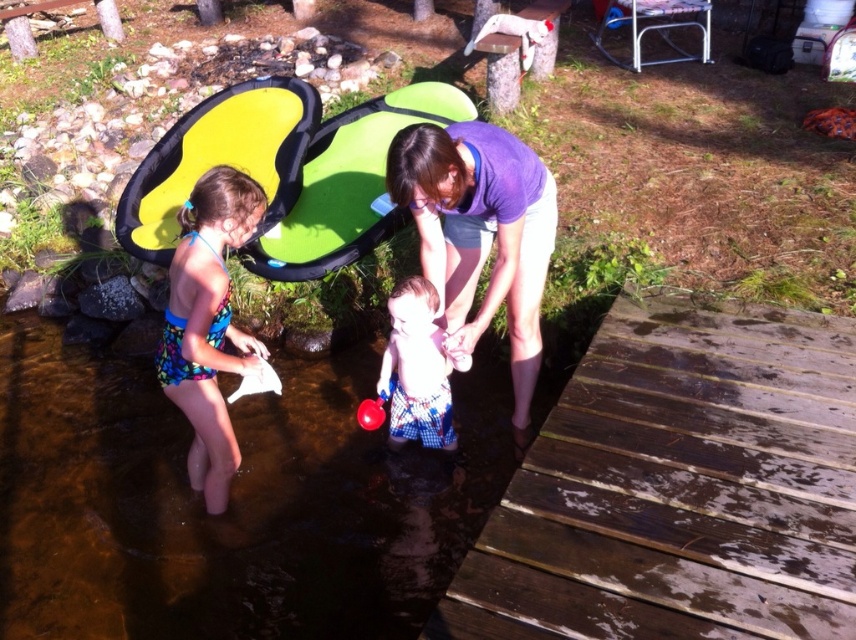
Question: Does brown wooden dock at lower right come in front of purple cotton shirt at center?

Choices:
 (A) no
 (B) yes

Answer: (B)

Question: Is clear water at center below plaid shorts at center?

Choices:
 (A) no
 (B) yes

Answer: (B)

Question: Estimate the real-world distances between objects in this image. Which object is closer to the purple cotton shirt at center?

Choices:
 (A) brown wooden dock at lower right
 (B) green inflatable at upper center

Answer: (A)

Question: Is purple cotton shirt at center above multicolored fabric swimsuit at lower left?

Choices:
 (A) no
 (B) yes

Answer: (B)

Question: Which point is closer to the camera taking this photo?

Choices:
 (A) (174, 266)
 (B) (476, 276)

Answer: (A)

Question: Which of the following is the closest to the observer?

Choices:
 (A) (525, 604)
 (B) (176, 152)
 (C) (194, 412)
 (D) (406, 353)

Answer: (A)